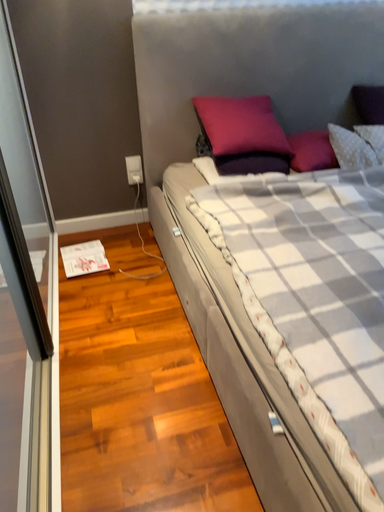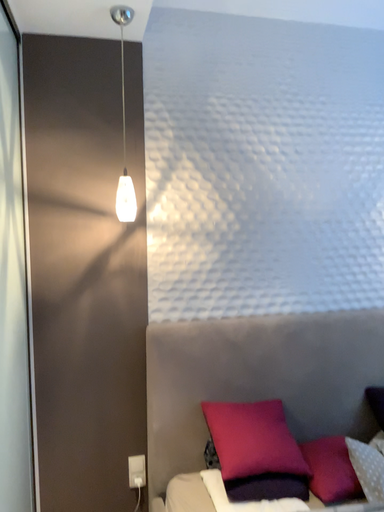
Question: Which way did the camera rotate in the video?

Choices:
 (A) rotated downward
 (B) rotated upward

Answer: (B)